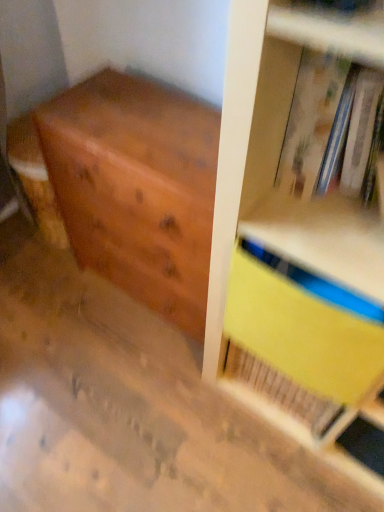
Question: Is hardcover book at upper right further to the viewer compared to yellow matte paper at upper right?

Choices:
 (A) no
 (B) yes

Answer: (A)

Question: From the image's perspective, is hardcover book at upper right beneath yellow matte paper at upper right?

Choices:
 (A) yes
 (B) no

Answer: (B)

Question: Can you confirm if hardcover book at upper right is taller than yellow matte paper at upper right?

Choices:
 (A) no
 (B) yes

Answer: (A)

Question: Is hardcover book at upper right located outside yellow matte paper at upper right?

Choices:
 (A) no
 (B) yes

Answer: (B)

Question: Could yellow matte paper at upper right be considered to be inside hardcover book at upper right?

Choices:
 (A) yes
 (B) no

Answer: (B)

Question: Could you tell me if hardcover book at upper right is facing yellow matte paper at upper right?

Choices:
 (A) yes
 (B) no

Answer: (B)

Question: From the image's perspective, would you say wooden chest of drawers at left is shown under yellow matte paper at upper right?

Choices:
 (A) yes
 (B) no

Answer: (B)

Question: Is wooden chest of drawers at left facing away from yellow matte paper at upper right?

Choices:
 (A) yes
 (B) no

Answer: (B)

Question: From a real-world perspective, is wooden chest of drawers at left on top of yellow matte paper at upper right?

Choices:
 (A) yes
 (B) no

Answer: (B)

Question: Can you confirm if wooden chest of drawers at left is bigger than yellow matte paper at upper right?

Choices:
 (A) yes
 (B) no

Answer: (A)

Question: From a real-world perspective, does wooden chest of drawers at left sit lower than yellow matte paper at upper right?

Choices:
 (A) yes
 (B) no

Answer: (A)

Question: Does wooden chest of drawers at left come in front of yellow matte paper at upper right?

Choices:
 (A) no
 (B) yes

Answer: (A)

Question: Is hardcover book at upper right to the right of wooden chest of drawers at left from the viewer's perspective?

Choices:
 (A) yes
 (B) no

Answer: (A)